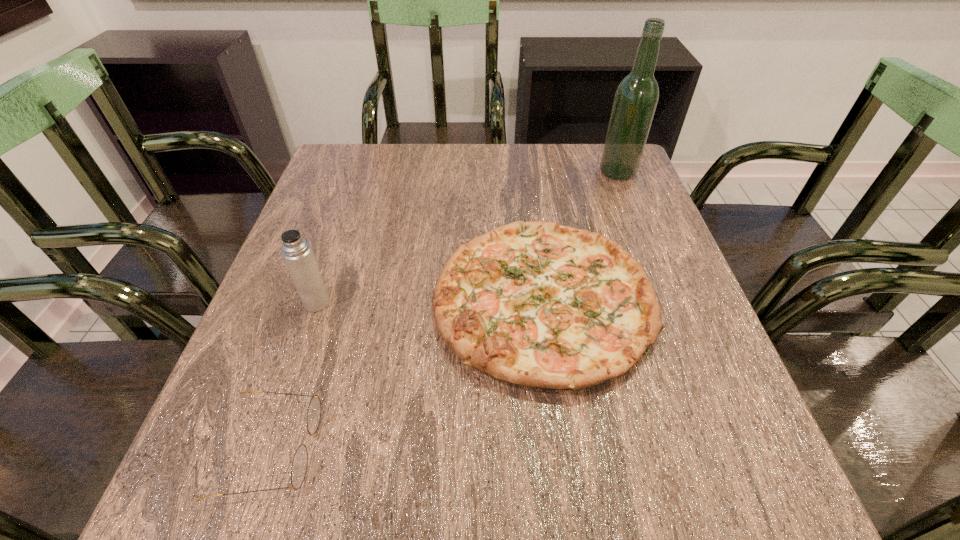
In order to click on object situated at the near edge in this screenshot , I will do `click(300, 461)`.

The width and height of the screenshot is (960, 540). I want to click on thermos bottle at the left edge, so (297, 253).

Locate an element on the screen. This screenshot has height=540, width=960. spectacles at the left edge is located at coordinates (300, 461).

Find the location of `liquor that is at the right edge`. liquor that is at the right edge is located at coordinates pyautogui.click(x=636, y=98).

Identify the location of pizza at the right edge. (537, 304).

Find the location of a particular element. The width and height of the screenshot is (960, 540). object that is at the near left corner is located at coordinates (300, 461).

At what (x,y) coordinates should I click in order to perform the action: click on object that is at the far right corner. Please return your answer as a coordinate pair (x, y). The width and height of the screenshot is (960, 540). Looking at the image, I should click on (636, 98).

Locate an element on the screen. The height and width of the screenshot is (540, 960). free space at the far edge of the desktop is located at coordinates pyautogui.click(x=401, y=150).

In order to click on free space at the near edge in this screenshot , I will do `click(636, 518)`.

You are a GUI agent. You are given a task and a screenshot of the screen. Output one action in this format:
    pyautogui.click(x=<x>, y=<y>)
    Task: Click on the vacant region at the left edge
    This screenshot has height=540, width=960.
    Given the screenshot: What is the action you would take?
    pyautogui.click(x=284, y=400)